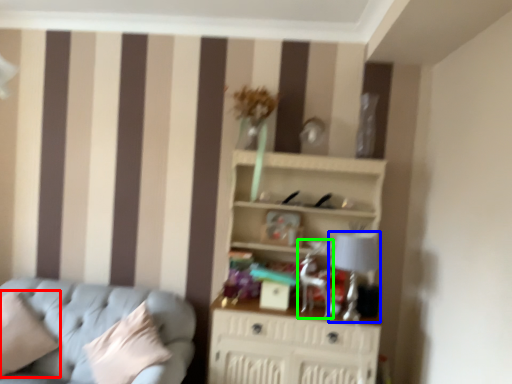
Question: Which object is positioned closest to pillow (highlighted by a red box)? Select from table lamp (highlighted by a blue box) and swivel chair (highlighted by a green box).

Choices:
 (A) table lamp
 (B) swivel chair

Answer: (B)